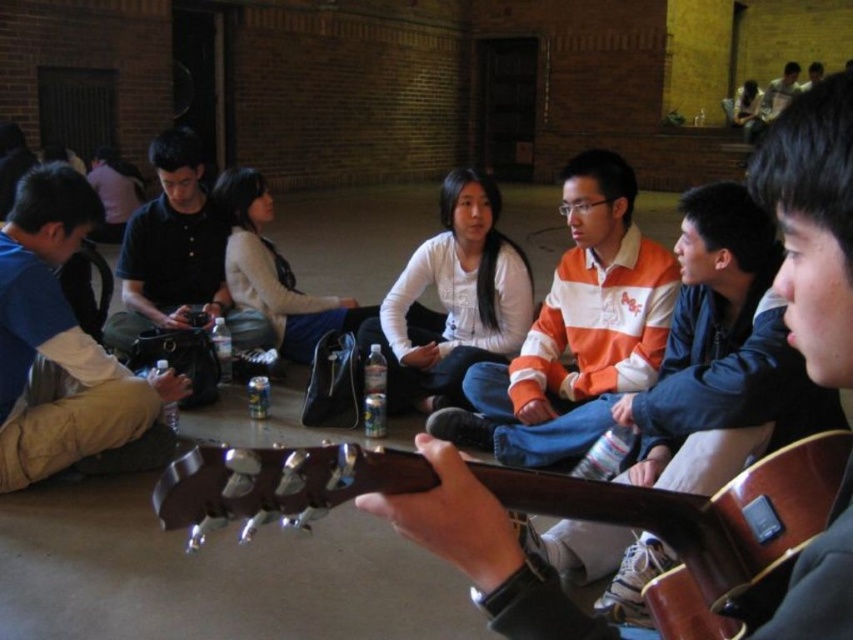
You are organizing a photoshoot and need to decide which clothing item to feature in the foreground. Given that you want the item to be more prominent due to its size, which one should you choose between the white striped sweater at center and the white matte shirt at center?

The white striped sweater at center is larger in size than the white matte shirt at center, so you should choose the white striped sweater at center to be featured in the foreground for prominence.

You are a photographer setting up for a group photo. You want to ensure both the white striped sweater at center and the blue fabric shirt at left are visible in the shot. Given their positions, which clothing item might be partially obscured, and why?

The blue fabric shirt at left might be partially obscured because it is positioned behind the white striped sweater at center, making it harder to see fully.